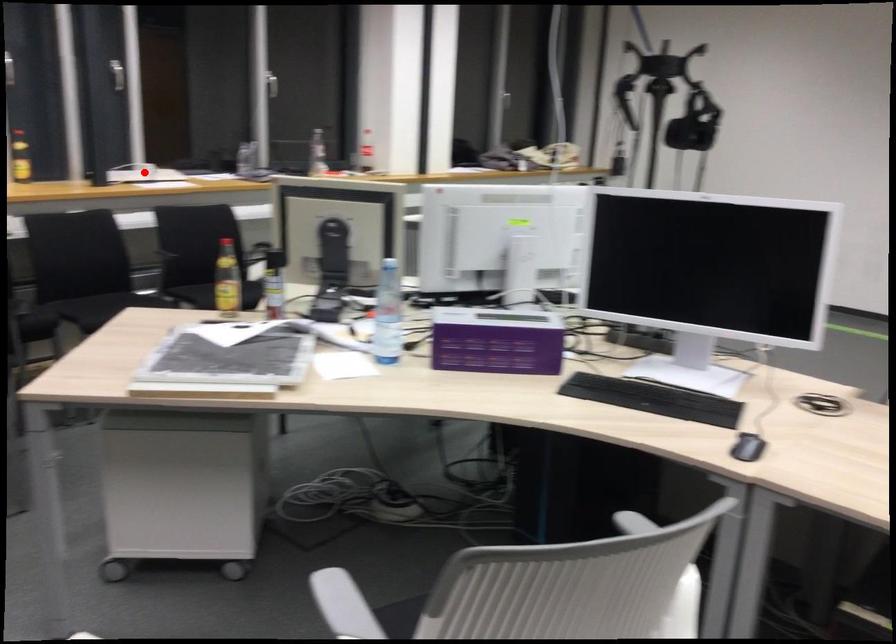
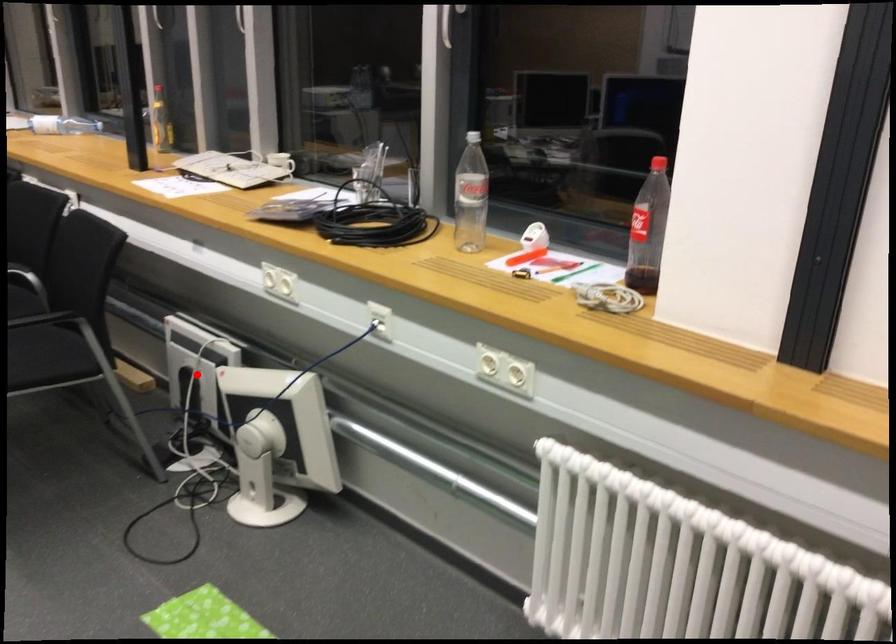
I am providing you with two images of the same scene from different viewpoints. A red point is marked on the first image and another point is marked on the second image. Is the marked point in image1 the same physical position as the marked point in image2?

No